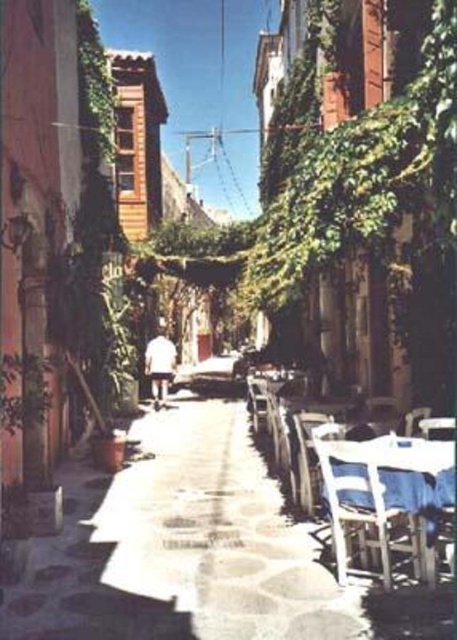
You are a tourist standing at the entrance of the street and want to sit down. You see a wooden table at lower right and a white plastic chair at lower right. Which object should you approach first to sit?

You should approach the wooden table at lower right first because it is in front of the white plastic chair at lower right, meaning the chair is behind the table and closer to you.

You are a tourist standing at the entrance of the street and want to sit down to enjoy a coffee. You see a wooden table at lower right and a white plastic chair at center. Which object is closer to you so you can reach it first?

The wooden table at lower right is closer to the viewer than the white plastic chair at center, so you can reach it first.